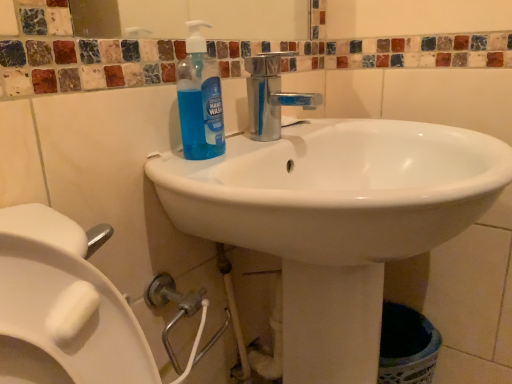
Question: Does blue translucent liquid at sink have a greater height compared to white glossy sink at center?

Choices:
 (A) no
 (B) yes

Answer: (A)

Question: Considering the relative sizes of blue translucent liquid at sink and white glossy sink at center in the image provided, is blue translucent liquid at sink thinner than white glossy sink at center?

Choices:
 (A) yes
 (B) no

Answer: (A)

Question: Would you consider blue translucent liquid at sink to be distant from white glossy sink at center?

Choices:
 (A) no
 (B) yes

Answer: (A)

Question: From the image's perspective, does blue translucent liquid at sink appear lower than white glossy sink at center?

Choices:
 (A) no
 (B) yes

Answer: (A)

Question: From a real-world perspective, is blue translucent liquid at sink located beneath white glossy sink at center?

Choices:
 (A) yes
 (B) no

Answer: (B)

Question: Is blue translucent liquid at sink turned away from white glossy sink at center?

Choices:
 (A) yes
 (B) no

Answer: (A)

Question: Does white glossy sink at center have a smaller size compared to blue translucent liquid at sink?

Choices:
 (A) yes
 (B) no

Answer: (B)

Question: From the image's perspective, is white glossy sink at center beneath blue translucent liquid at sink?

Choices:
 (A) yes
 (B) no

Answer: (A)

Question: Is white glossy sink at center outside blue translucent liquid at sink?

Choices:
 (A) no
 (B) yes

Answer: (B)

Question: Does white glossy sink at center come behind blue translucent liquid at sink?

Choices:
 (A) no
 (B) yes

Answer: (A)

Question: From a real-world perspective, is white glossy sink at center physically above blue translucent liquid at sink?

Choices:
 (A) no
 (B) yes

Answer: (A)

Question: Is white glossy sink at center to the right of blue translucent liquid at sink from the viewer's perspective?

Choices:
 (A) no
 (B) yes

Answer: (B)

Question: Is white glossy sink at center in front of or behind blue translucent liquid at sink in the image?

Choices:
 (A) front
 (B) behind

Answer: (A)